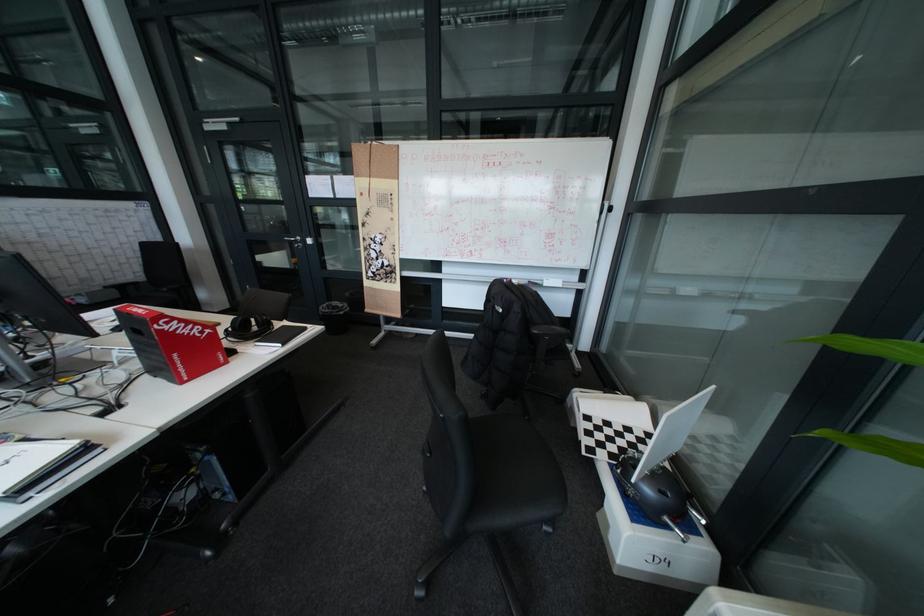
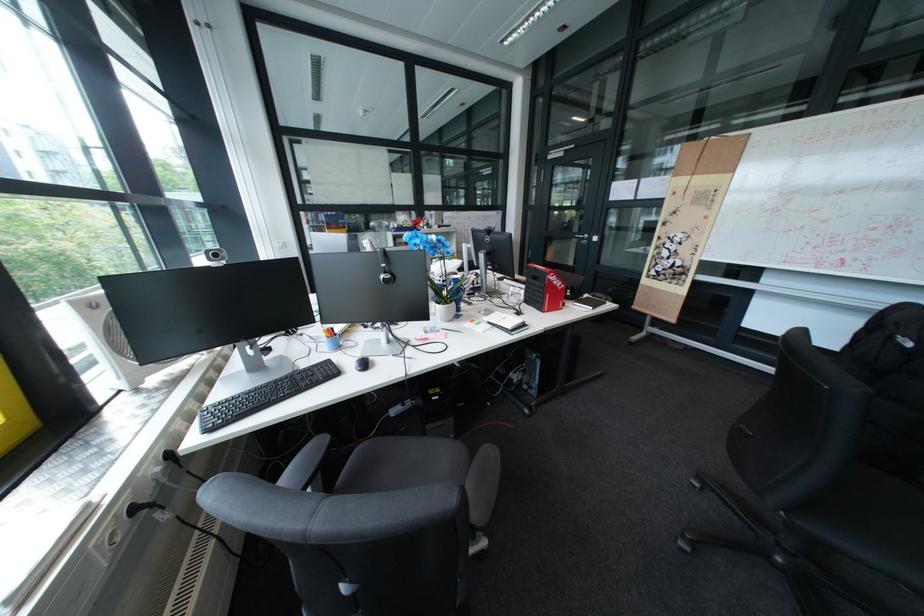
Where in the second image is the point corresponding to (x=160, y=376) from the first image?

(538, 304)